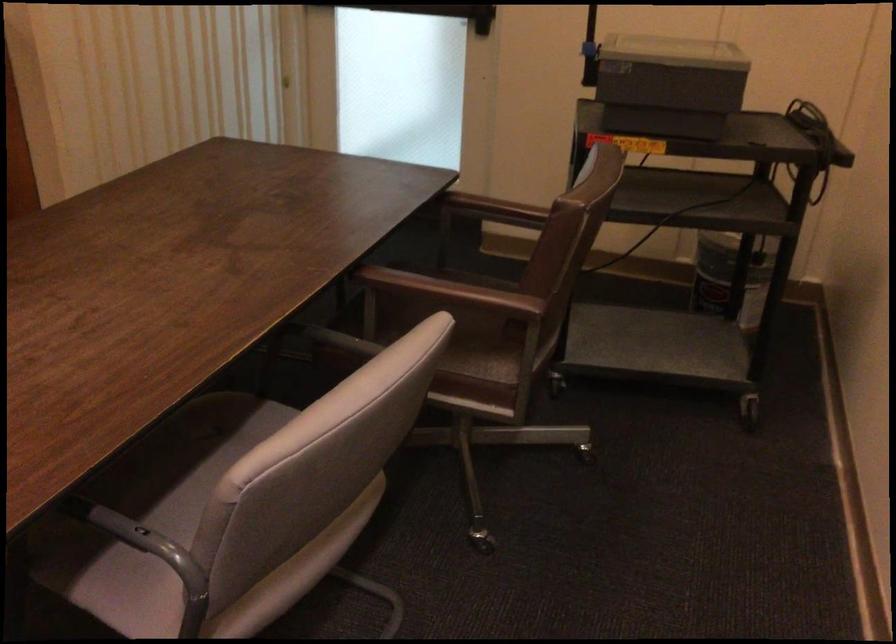
Where is `grey chair armrest`? grey chair armrest is located at coordinates (140, 538).